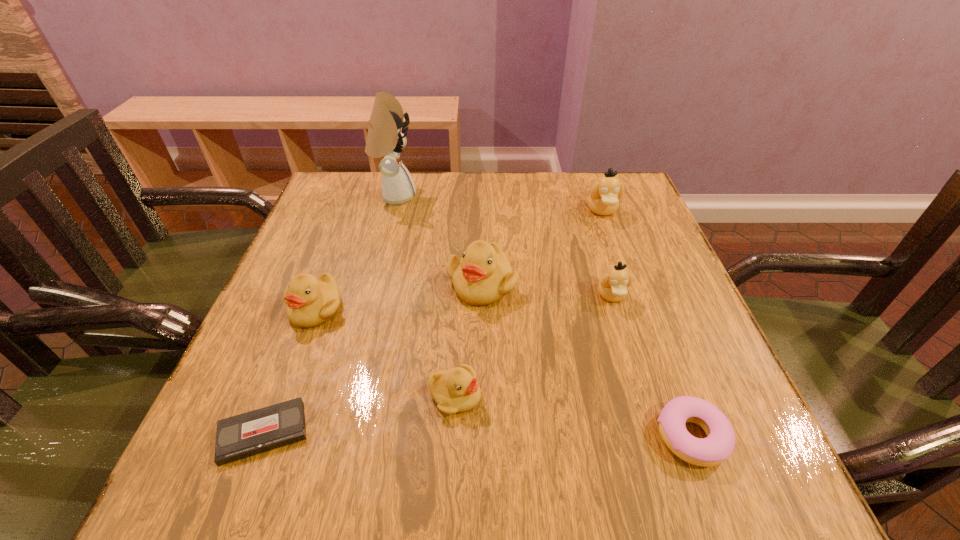
Find the location of `pink doughnut`. pink doughnut is located at coordinates (716, 448).

You are a GUI agent. You are given a task and a screenshot of the screen. Output one action in this format:
    pyautogui.click(x=<x>, y=<y>)
    Task: Click on the doughnut
    
    Given the screenshot: What is the action you would take?
    pyautogui.click(x=716, y=448)

Where is `videotape`? videotape is located at coordinates (244, 435).

Find the location of `vacant space located at the front face of the black doll`. vacant space located at the front face of the black doll is located at coordinates (546, 196).

Where is `vacant space situated 0.080m on the face of the farthest duckling`? This screenshot has width=960, height=540. vacant space situated 0.080m on the face of the farthest duckling is located at coordinates [614, 244].

This screenshot has width=960, height=540. I want to click on vacant space located on the front-facing side of the biggest yellow duckling, so click(482, 340).

Where is `free space located on the front-facing side of the leftmost duckling`? This screenshot has height=540, width=960. free space located on the front-facing side of the leftmost duckling is located at coordinates (297, 360).

Locate an element on the screen. The width and height of the screenshot is (960, 540). vacant point located 0.210m on the face of the smaller tan duckling is located at coordinates (645, 404).

Find the location of a particular element. This screenshot has width=960, height=540. vacant space located on the front-facing side of the smallest yellow duckling is located at coordinates (683, 395).

This screenshot has height=540, width=960. In order to click on blank area located 0.330m on the back of the doughnut in this screenshot , I will do `click(631, 272)`.